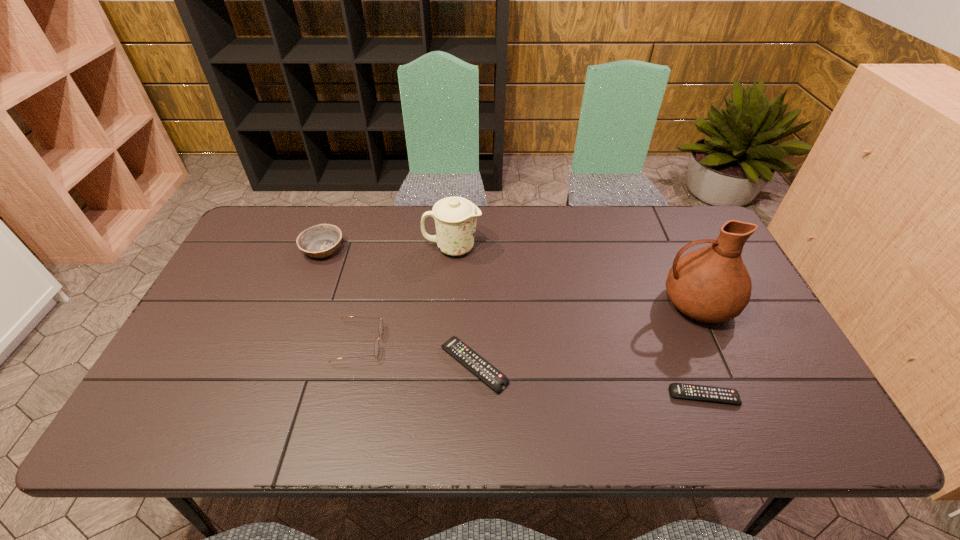
The width and height of the screenshot is (960, 540). Identify the location of free location that satisfies the following two spatial constraints: 1. on the temples of the spectacles; 2. on the left side of the shortest object. coord(347,396).

Identify the location of free spot that satisfies the following two spatial constraints: 1. on the side of the pitcher with the handle; 2. on the front side of the fifth tallest object. (724, 366).

Where is `vacant area that satisfies the following two spatial constraints: 1. on the spout of the chinaware; 2. on the front side of the bowl`? The image size is (960, 540). vacant area that satisfies the following two spatial constraints: 1. on the spout of the chinaware; 2. on the front side of the bowl is located at coordinates click(x=452, y=249).

The height and width of the screenshot is (540, 960). Find the location of `free spot that satisfies the following two spatial constraints: 1. on the front side of the leftmost object; 2. on the right side of the shortest object`. free spot that satisfies the following two spatial constraints: 1. on the front side of the leftmost object; 2. on the right side of the shortest object is located at coordinates 267,396.